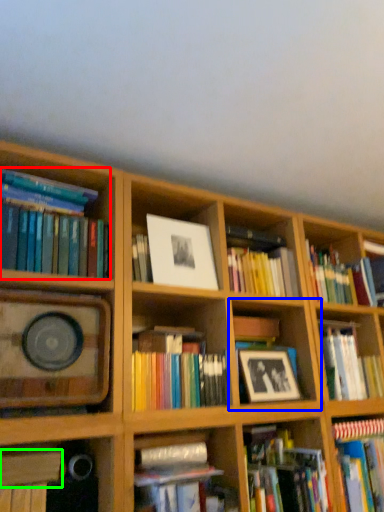
Question: Which is farther away from book (highlighted by a red box)? shelf (highlighted by a blue box) or book (highlighted by a green box)?

Choices:
 (A) shelf
 (B) book

Answer: (A)